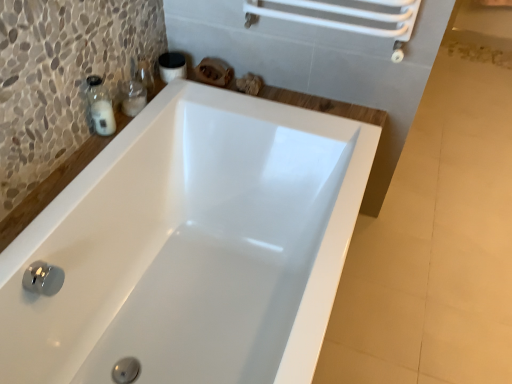
Question: Is transparent glass soap dispenser at upper left taller or shorter than white glossy bathtub at center?

Choices:
 (A) tall
 (B) short

Answer: (B)

Question: From a real-world perspective, is transparent glass soap dispenser at upper left positioned above or below white glossy bathtub at center?

Choices:
 (A) below
 (B) above

Answer: (B)

Question: Is transparent glass soap dispenser at upper left spatially inside white glossy bathtub at center, or outside of it?

Choices:
 (A) inside
 (B) outside

Answer: (B)

Question: Looking at the image, does white glossy bathtub at center seem bigger or smaller compared to transparent glass soap dispenser at upper left?

Choices:
 (A) big
 (B) small

Answer: (A)

Question: Is point (111, 210) positioned closer to the camera than point (96, 127)?

Choices:
 (A) closer
 (B) farther

Answer: (A)

Question: From a real-world perspective, is white glossy bathtub at center physically located above or below transparent glass soap dispenser at upper left?

Choices:
 (A) above
 (B) below

Answer: (B)

Question: Looking at their shapes, would you say white glossy bathtub at center is wider or thinner than transparent glass soap dispenser at upper left?

Choices:
 (A) wide
 (B) thin

Answer: (A)